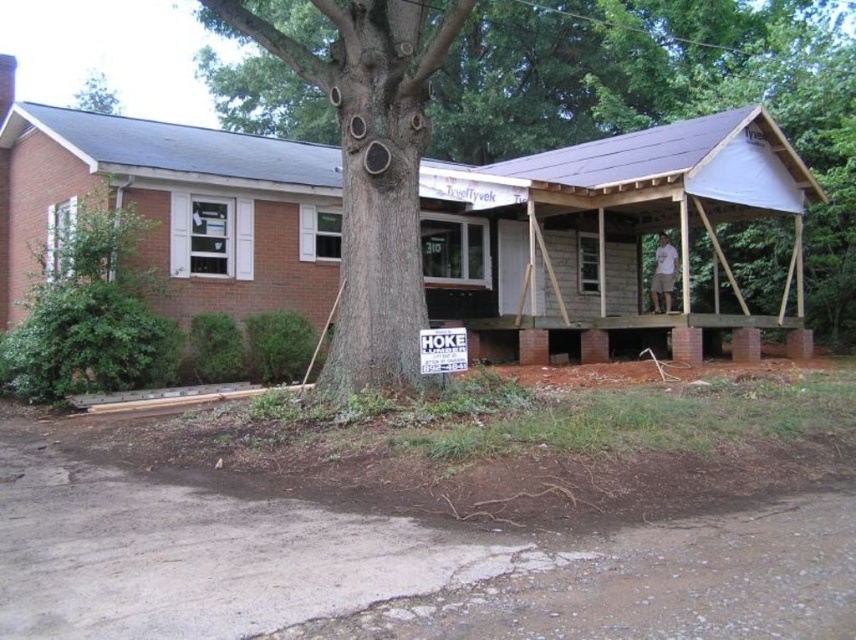
Question: Does brown rough bark tree at center have a smaller size compared to green rough bark tree at upper center?

Choices:
 (A) no
 (B) yes

Answer: (A)

Question: Does brown rough bark tree at center appear on the left side of gray textured tree trunk at center?

Choices:
 (A) no
 (B) yes

Answer: (A)

Question: Can you confirm if gray textured tree trunk at center is positioned below green rough bark tree at upper center?

Choices:
 (A) yes
 (B) no

Answer: (A)

Question: Based on their relative distances, which object is farther from the white paper sign at center?

Choices:
 (A) brown rough bark tree at center
 (B) gray textured tree trunk at center
 (C) green rough bark tree at upper center

Answer: (C)

Question: Which of the following is the closest to the observer?

Choices:
 (A) gray textured tree trunk at center
 (B) green rough bark tree at upper center
 (C) brown rough bark tree at center

Answer: (A)

Question: Which of the following is the closest to the observer?

Choices:
 (A) gray textured tree trunk at center
 (B) brick/wooden porch at center
 (C) green rough bark tree at upper center

Answer: (A)